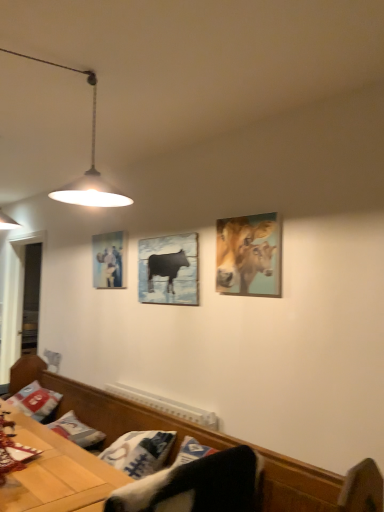
At what (x,y) coordinates should I click in order to perform the action: click on free point above metallic pendant light at upper left (from a real-world perspective). Please return your answer as a coordinate pair (x, y). This screenshot has width=384, height=512. Looking at the image, I should click on (65, 62).